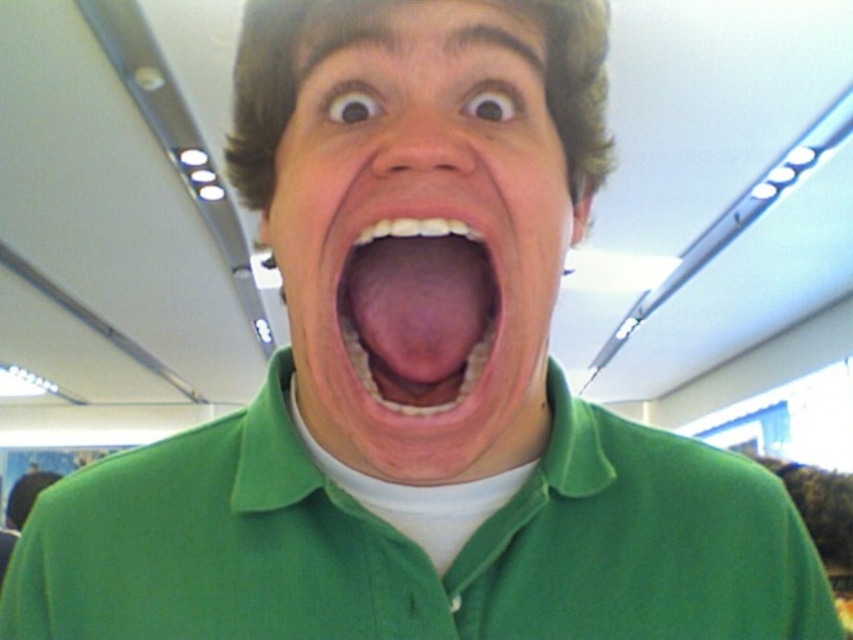
From the picture: Who is lower down, green matte face at center or green matte polo shirt at center?

green matte polo shirt at center is lower down.

Who is shorter, green matte face at center or green matte polo shirt at center?

green matte face at center

Is point (509, 83) more distant than point (0, 564)?

No, it is in front of (0, 564).

Find the location of a particular element. Image resolution: width=853 pixels, height=640 pixels. green matte face at center is located at coordinates (422, 236).

Does green matte face at center appear on the left side of pink flesh-colored tongue at center?

Incorrect, green matte face at center is not on the left side of pink flesh-colored tongue at center.

Measure the distance between green matte face at center and camera.

green matte face at center is 11.87 inches away from camera.

Who is more distant from viewer, (321, 225) or (432, 220)?

The point (321, 225) is more distant.

This screenshot has width=853, height=640. What are the coordinates of `green matte face at center` in the screenshot? It's located at (422, 236).

Who is taller, pink flesh-colored tongue at center or green matte polo shirt at center?

green matte polo shirt at center is taller.

Between point (473, 232) and point (430, 513), which one is positioned in front?

Point (473, 232)

The width and height of the screenshot is (853, 640). In order to click on pink flesh-colored tongue at center in this screenshot , I will do `click(410, 403)`.